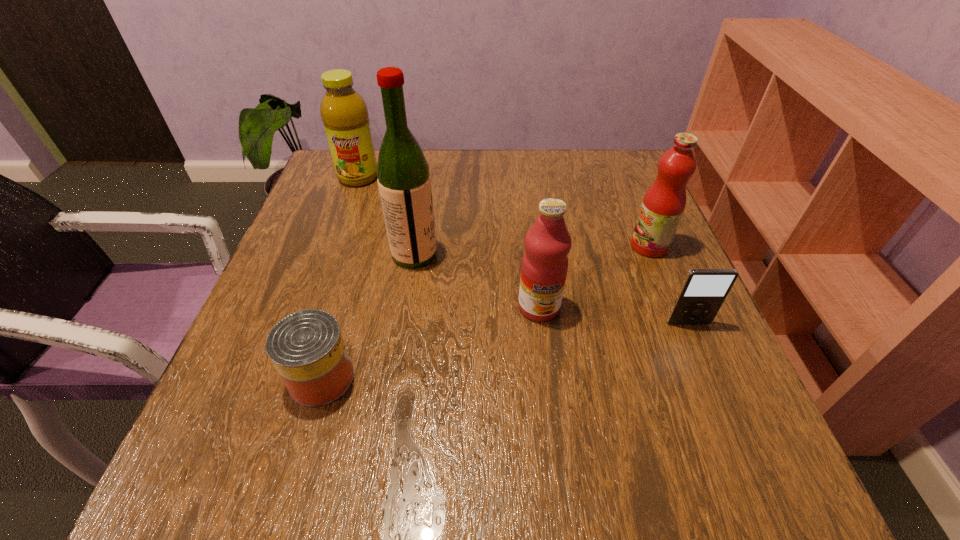
Locate an element on the screen. Image resolution: width=960 pixels, height=540 pixels. vacant region at the near right corner of the desktop is located at coordinates (691, 488).

Identify the location of vacant area between the second fruit juice from left to right and the farthest object. Image resolution: width=960 pixels, height=540 pixels. (449, 242).

This screenshot has height=540, width=960. I want to click on unoccupied area between the shortest object and the iPod, so click(505, 350).

Locate an element on the screen. This screenshot has height=540, width=960. blank region between the second farthest fruit juice and the farthest fruit juice is located at coordinates (504, 212).

At what (x,y) coordinates should I click in order to perform the action: click on free spot between the second shortest object and the nearest object. Please return your answer as a coordinate pair (x, y). Image resolution: width=960 pixels, height=540 pixels. Looking at the image, I should click on (505, 350).

This screenshot has height=540, width=960. In order to click on empty space that is in between the second shortest object and the can in this screenshot , I will do `click(505, 350)`.

Find the location of a particular element. vacant point located between the farthest fruit juice and the can is located at coordinates [340, 278].

Image resolution: width=960 pixels, height=540 pixels. Find the location of `free space that is in between the liquor and the nearest object`. free space that is in between the liquor and the nearest object is located at coordinates (368, 316).

You are a GUI agent. You are given a task and a screenshot of the screen. Output one action in this format:
    pyautogui.click(x=<x>, y=<y>)
    Task: Click on the vacant space that is in between the fifth tallest object and the nearest fruit juice
    The height and width of the screenshot is (540, 960).
    Given the screenshot: What is the action you would take?
    pyautogui.click(x=613, y=315)

You are a GUI agent. You are given a task and a screenshot of the screen. Output one action in this format:
    pyautogui.click(x=<x>, y=<y>)
    Task: Click on the unoccupied position between the nearest object and the second shortest object
    The image size is (960, 540).
    Given the screenshot: What is the action you would take?
    pyautogui.click(x=505, y=350)